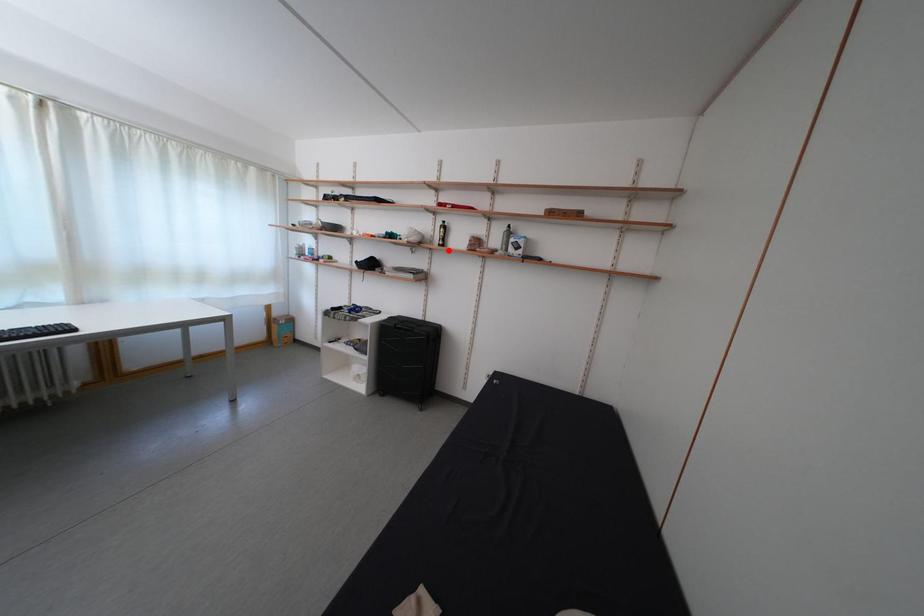
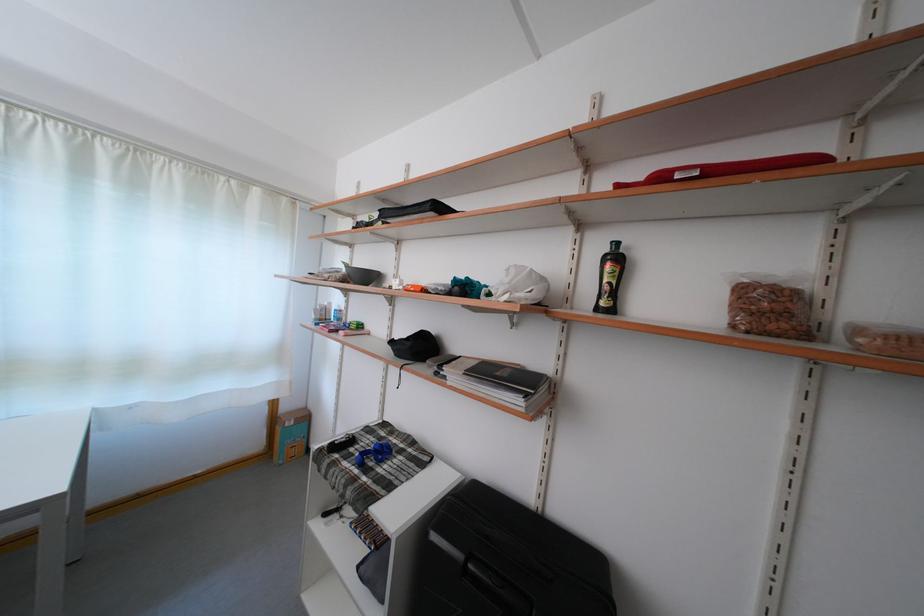
Question: I am providing you with two images of the same scene from different viewpoints. Image1 has a red point marked. In image2, the corresponding 3D location appears at what relative position? Reply with the corresponding letter.

Choices:
 (A) Closer
 (B) Farther

Answer: (B)